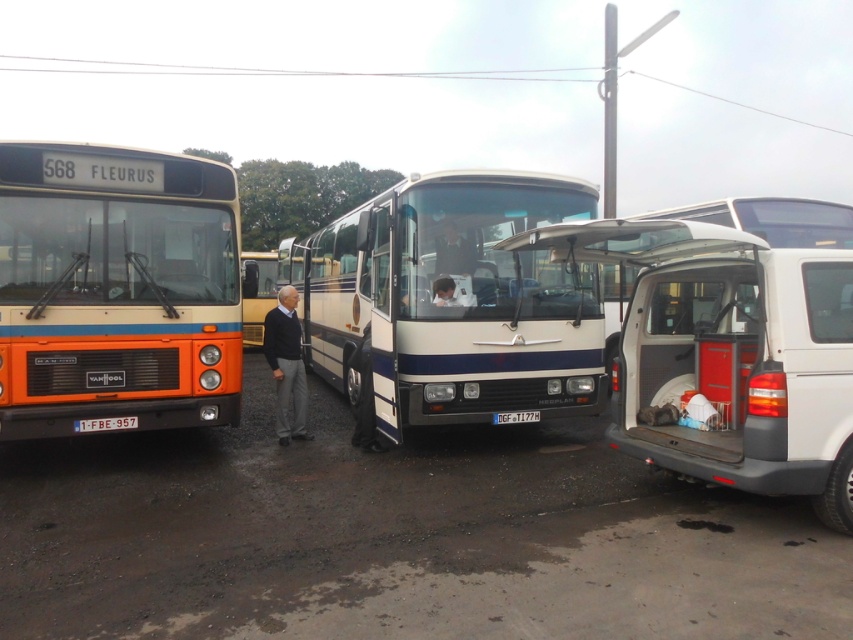
Question: Is orange matte bus at left positioned behind black plastic license plate at center?

Choices:
 (A) no
 (B) yes

Answer: (A)

Question: Which point is closer to the camera?

Choices:
 (A) (117, 426)
 (B) (503, 419)
 (C) (282, 252)

Answer: (A)

Question: Can you confirm if gray wool sweater at center is smaller than smooth skin face at center?

Choices:
 (A) no
 (B) yes

Answer: (A)

Question: Which point is closer to the camera?

Choices:
 (A) (103, 422)
 (B) (387, 387)
 (C) (447, 289)

Answer: (A)

Question: Which object appears farthest from the camera in this image?

Choices:
 (A) white glossy bus at center
 (B) smooth skin face at center
 (C) orange matte bus at left

Answer: (B)

Question: Is gray wool sweater at center further to camera compared to white plastic license plate at center?

Choices:
 (A) no
 (B) yes

Answer: (B)